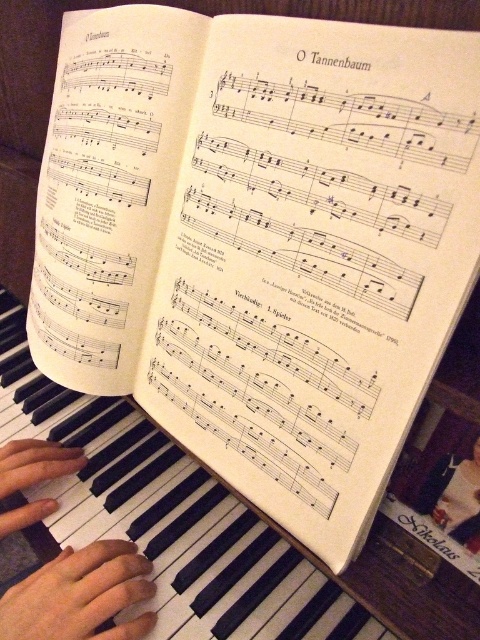
You are a piano student trying to play the song O Tannenbaum. The sheet music shows a note at point (166, 516). Where should you place your finger to play that note?

The point (166, 516) is on black matte piano keys at center, so you should place your finger on the black keys at the center of the piano.

You are a piano teacher observing a student playing the piece. You notice the student has their hand positioned on the left side of the piano keys. Which object is closer to you, the teacher, between the black matte piano keys at center and the smooth skin hand at piano keys left?

The black matte piano keys at center are closer to the viewer than the smooth skin hand at piano keys left, so the black matte piano keys at center is closer to you, the teacher.